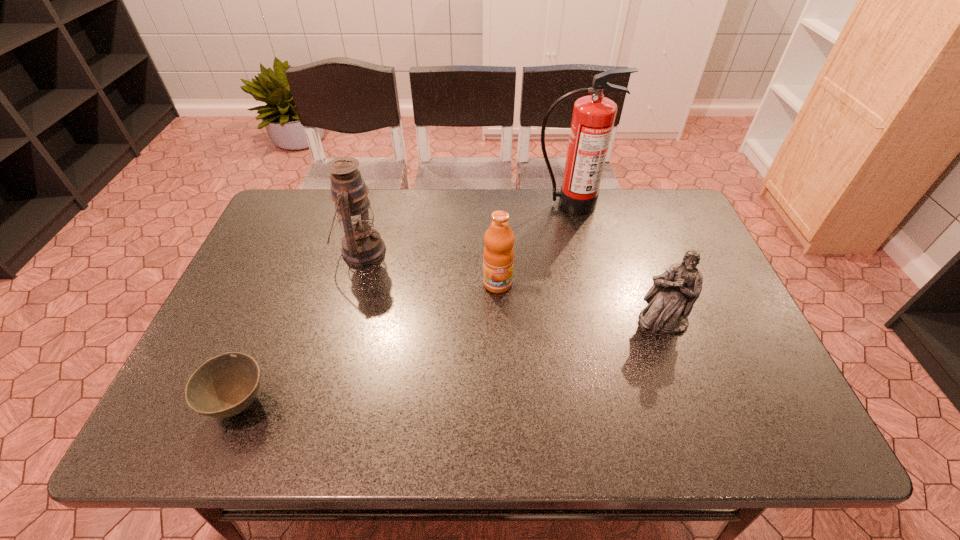
The image size is (960, 540). I want to click on empty location between the figurine and the fire extinguisher, so click(616, 263).

This screenshot has width=960, height=540. In order to click on vacant space that's between the farthest object and the leftmost object in this screenshot , I will do `click(404, 303)`.

Locate an element on the screen. unoccupied area between the oil lamp and the leftmost object is located at coordinates (300, 327).

Image resolution: width=960 pixels, height=540 pixels. Identify the location of free space that is in between the fourth farthest object and the nearest object. (451, 363).

Find the location of `unoccupied position between the second object from left to right and the farthest object`. unoccupied position between the second object from left to right and the farthest object is located at coordinates (466, 227).

Select which object is the fourth closest to the oil lamp. Please provide its 2D coordinates. Your answer should be formatted as a tuple, i.e. [(x, y)], where the tuple contains the x and y coordinates of a point satisfying the conditions above.

[(670, 300)]

Point out which object is positioned as the fourth nearest to the oil lamp. Please provide its 2D coordinates. Your answer should be formatted as a tuple, i.e. [(x, y)], where the tuple contains the x and y coordinates of a point satisfying the conditions above.

[(670, 300)]